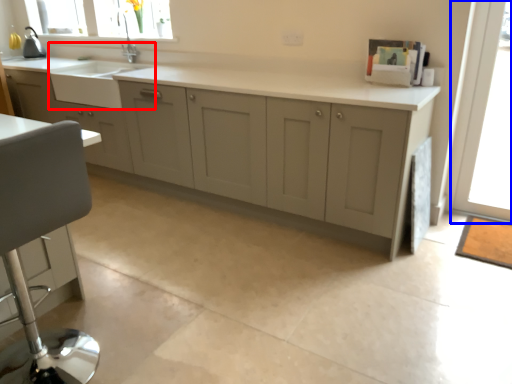
Question: Which point is further to the camera, sink (highlighted by a red box) or window screen (highlighted by a blue box)?

Choices:
 (A) sink
 (B) window screen

Answer: (A)